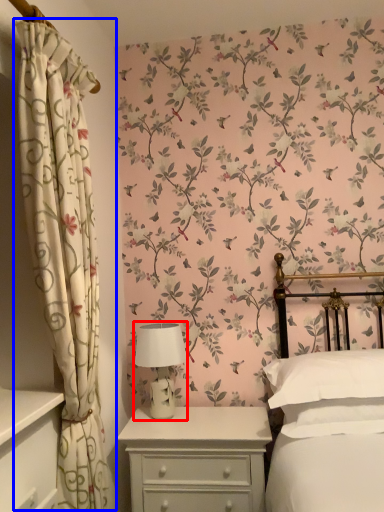
Question: Which point is further to the camera, table lamp (highlighted by a red box) or curtain (highlighted by a blue box)?

Choices:
 (A) table lamp
 (B) curtain

Answer: (A)